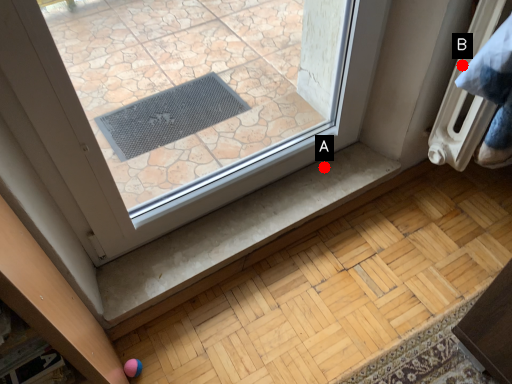
Question: Two points are circled on the image, labeled by A and B beside each circle. Which point is farther to the camera?

Choices:
 (A) A is further
 (B) B is further

Answer: (A)